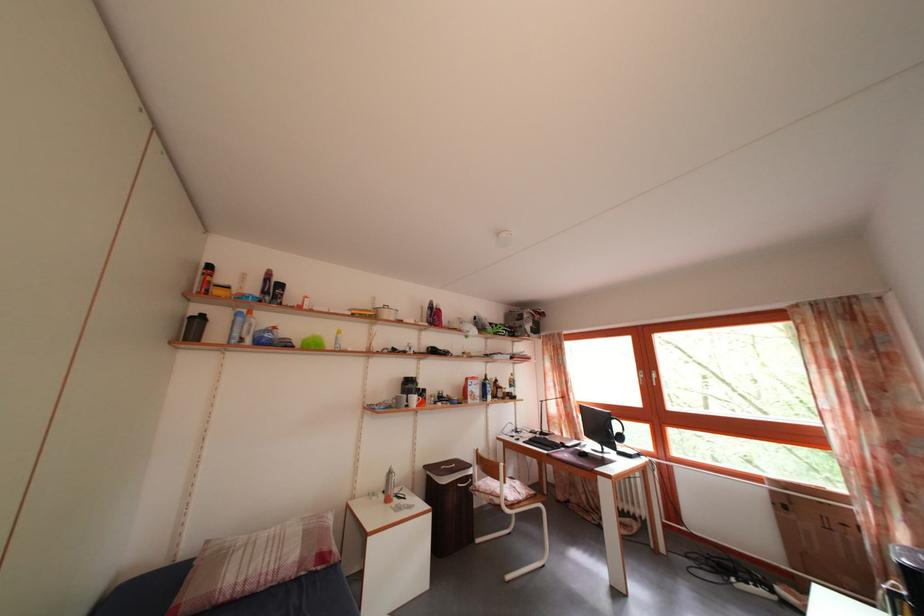
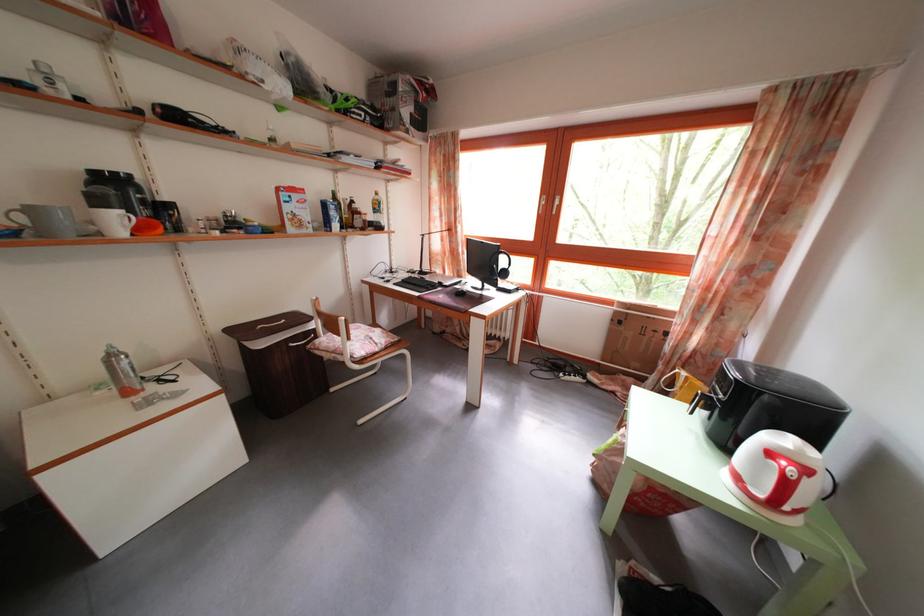
Find the pixel in the second image that matches the point at 781,500 in the first image.

(623, 320)